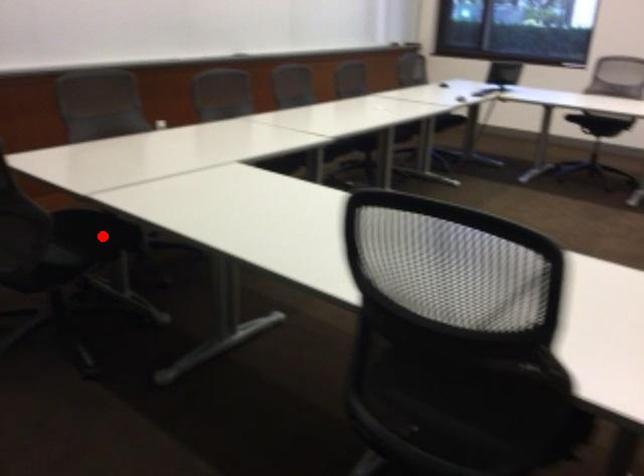
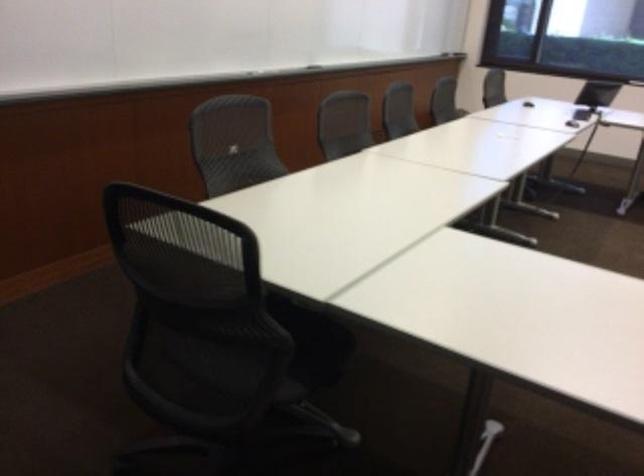
Question: I am providing you with two images of the same scene from different viewpoints. Image1 has a red point marked. In image2, the corresponding 3D location appears at what relative position? Reply with the corresponding letter.

Choices:
 (A) Closer
 (B) Farther

Answer: (A)